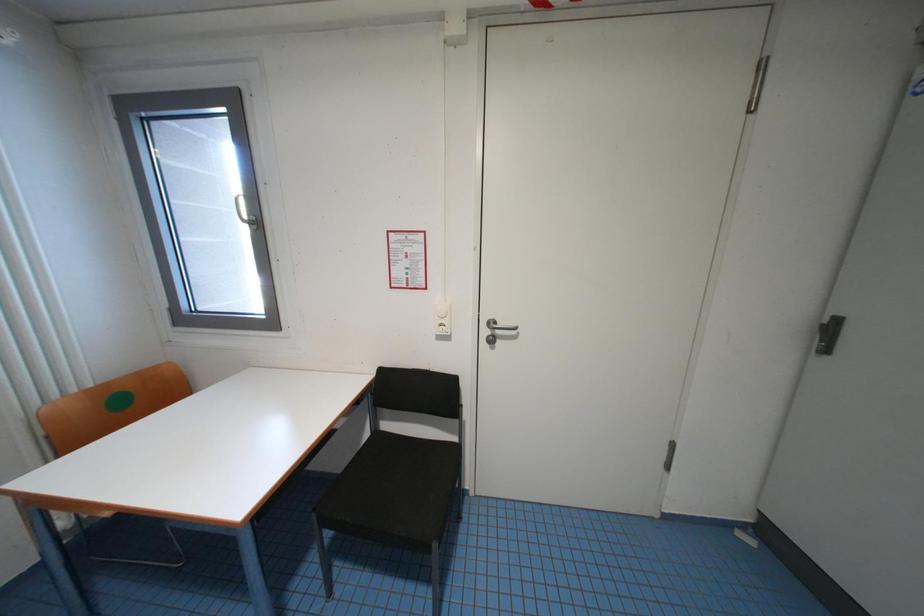
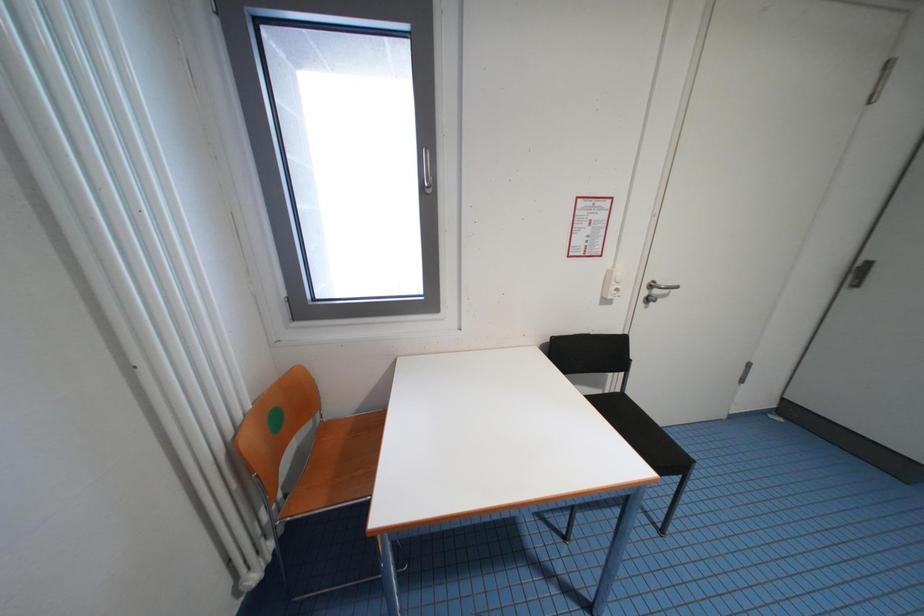
Question: Which direction would the cameraman need to move to produce the second image? Reply with the corresponding letter.

Choices:
 (A) Left
 (B) Right
 (C) Forward
 (D) Backward

Answer: (A)